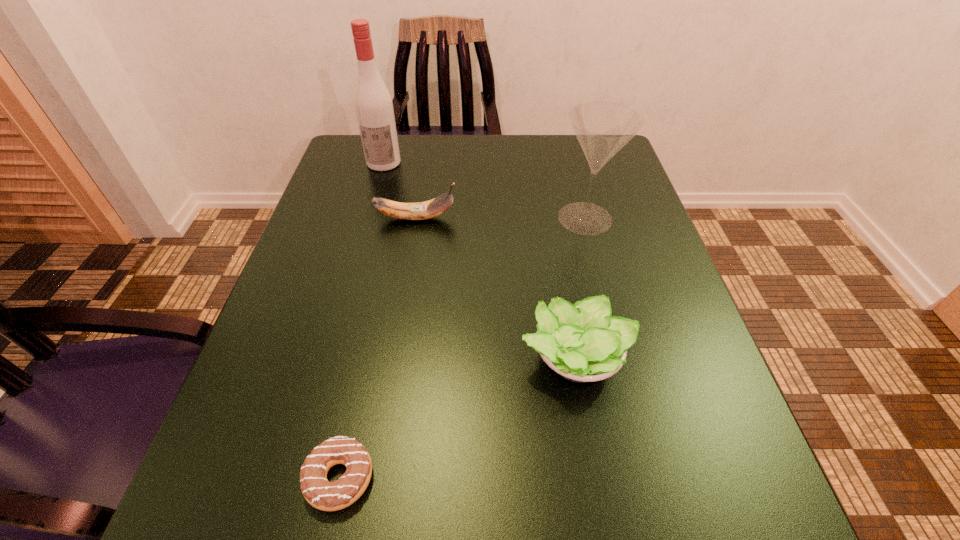
You are a GUI agent. You are given a task and a screenshot of the screen. Output one action in this format:
    pyautogui.click(x=<x>, y=<y>)
    Task: Click on the object that is at the far left corner
    This screenshot has width=960, height=540.
    Given the screenshot: What is the action you would take?
    pyautogui.click(x=373, y=104)

Find the location of a particular element. The image size is (960, 540). object positioned at the near left corner is located at coordinates (320, 493).

In the image, there is a desktop. Where is `vacant area at the far edge`? vacant area at the far edge is located at coordinates (547, 136).

Where is `blank space at the left edge of the desktop`? The width and height of the screenshot is (960, 540). blank space at the left edge of the desktop is located at coordinates (227, 470).

Image resolution: width=960 pixels, height=540 pixels. I want to click on blank area at the right edge, so click(x=612, y=307).

Identify the location of blank space at the far left corner of the desktop. This screenshot has height=540, width=960. (327, 186).

In the image, there is a desktop. Where is `vacant space at the far right corner`? The image size is (960, 540). vacant space at the far right corner is located at coordinates (576, 185).

Find the location of a particular element. Image resolution: width=960 pixels, height=540 pixels. unoccupied position between the tallest object and the fourth shortest object is located at coordinates (485, 190).

Identify the location of vacant point located between the tallest object and the shortest object. (362, 320).

Identify the location of vacant space that is in between the alcohol and the fourth shortest object. (485, 190).